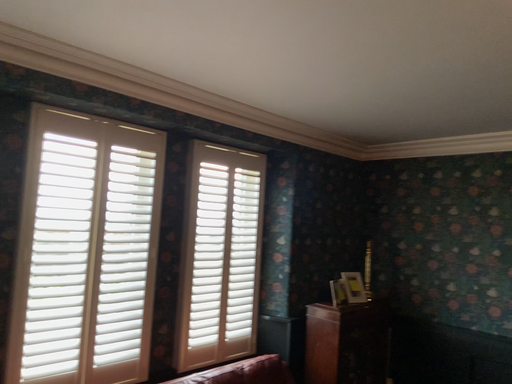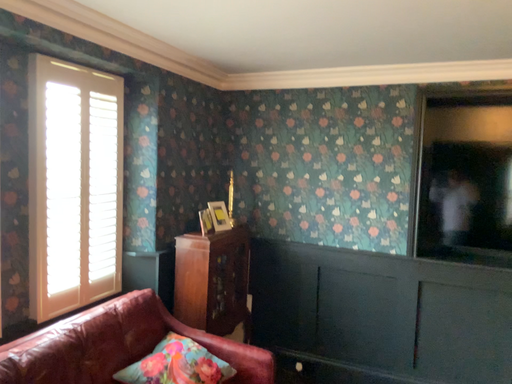
Question: How did the camera likely rotate when shooting the video?

Choices:
 (A) rotated downward
 (B) rotated upward

Answer: (A)